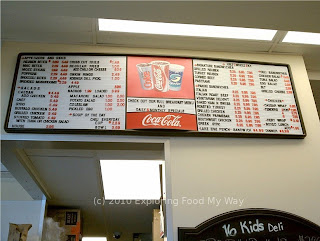
This screenshot has width=320, height=241. Find the location of `empty wall`. empty wall is located at coordinates (193, 170).